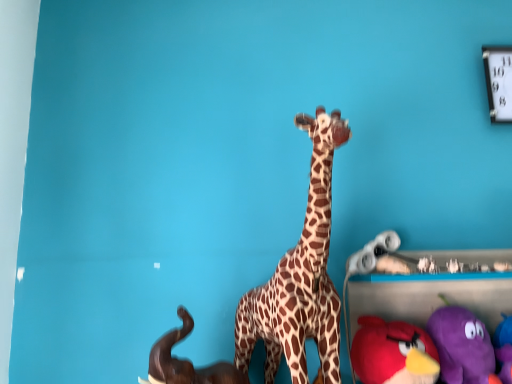
Question: Can you confirm if velvet plush bird at lower right, which appears as the second toy when viewed from the right, is positioned to the right of brown matte elephant at lower left, which appears as the 1th toy when viewed from the left?

Choices:
 (A) yes
 (B) no

Answer: (A)

Question: Is velvet plush bird at lower right, which appears as the second toy when viewed from the right, positioned in front of brown matte elephant at lower left, which appears as the 1th toy when viewed from the left?

Choices:
 (A) yes
 (B) no

Answer: (B)

Question: Are velvet plush bird at lower right, positioned as the 3th toy in left-to-right order, and brown matte elephant at lower left, marked as the 4th toy in a right-to-left arrangement, making contact?

Choices:
 (A) yes
 (B) no

Answer: (B)

Question: Is velvet plush bird at lower right, which appears as the second toy when viewed from the right, positioned with its back to brown matte elephant at lower left, which appears as the 1th toy when viewed from the left?

Choices:
 (A) yes
 (B) no

Answer: (B)

Question: Does velvet plush bird at lower right, positioned as the 3th toy in left-to-right order, have a smaller size compared to brown matte elephant at lower left, which appears as the 1th toy when viewed from the left?

Choices:
 (A) no
 (B) yes

Answer: (A)

Question: Is velvet plush bird at lower right, positioned as the 3th toy in left-to-right order, outside brown matte elephant at lower left, which appears as the 1th toy when viewed from the left?

Choices:
 (A) yes
 (B) no

Answer: (A)

Question: Is velvet plush bird at lower right, positioned as the 3th toy in left-to-right order, a part of purple plush toy at lower right, positioned as the 4th toy in left-to-right order?

Choices:
 (A) no
 (B) yes

Answer: (A)

Question: Is purple plush toy at lower right, the first toy positioned from the right, positioned with its back to velvet plush bird at lower right, positioned as the 3th toy in left-to-right order?

Choices:
 (A) yes
 (B) no

Answer: (B)

Question: Can you confirm if purple plush toy at lower right, the first toy positioned from the right, is positioned to the left of velvet plush bird at lower right, which appears as the second toy when viewed from the right?

Choices:
 (A) no
 (B) yes

Answer: (A)

Question: From the image's perspective, is purple plush toy at lower right, the first toy positioned from the right, on velvet plush bird at lower right, positioned as the 3th toy in left-to-right order?

Choices:
 (A) yes
 (B) no

Answer: (A)

Question: Does purple plush toy at lower right, positioned as the 4th toy in left-to-right order, lie in front of velvet plush bird at lower right, positioned as the 3th toy in left-to-right order?

Choices:
 (A) yes
 (B) no

Answer: (B)

Question: Would you say purple plush toy at lower right, the first toy positioned from the right, is a long distance from velvet plush bird at lower right, positioned as the 3th toy in left-to-right order?

Choices:
 (A) yes
 (B) no

Answer: (B)

Question: Is velvet plush bird at lower right, positioned as the 3th toy in left-to-right order, positioned far away from purple plush toy at lower right, the first toy positioned from the right?

Choices:
 (A) no
 (B) yes

Answer: (A)